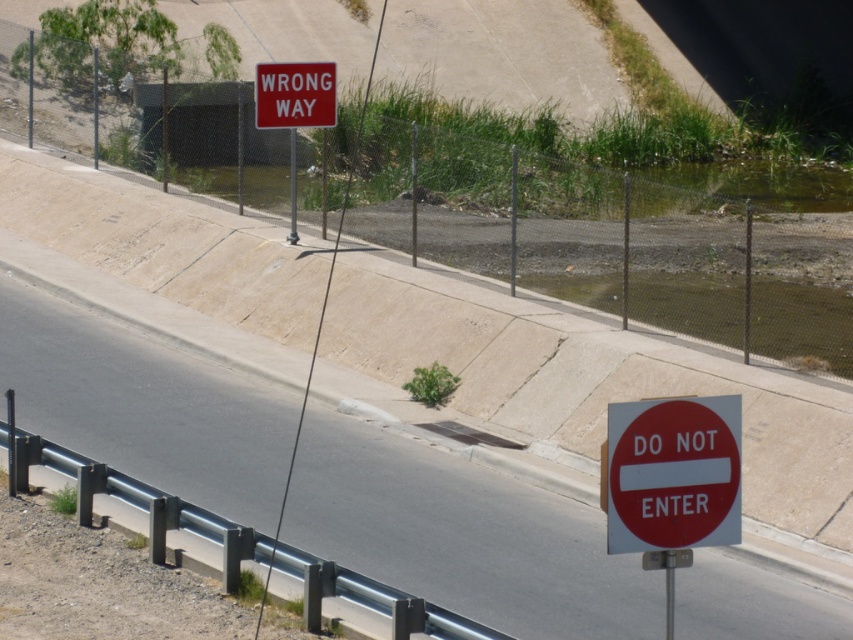
Question: Is red plastic sign at right further to the viewer compared to red matte sign at upper center?

Choices:
 (A) no
 (B) yes

Answer: (A)

Question: Does red plastic sign at right have a lesser width compared to red matte do not enter sign at lower right?

Choices:
 (A) yes
 (B) no

Answer: (B)

Question: Which point is closer to the camera?

Choices:
 (A) red matte sign at upper center
 (B) red matte do not enter sign at lower right
 (C) red plastic sign at right

Answer: (B)

Question: Which object is positioned farthest from the red matte sign at upper center?

Choices:
 (A) red matte do not enter sign at lower right
 (B) red plastic sign at right

Answer: (A)

Question: Can you confirm if red matte do not enter sign at lower right is wider than red matte sign at upper center?

Choices:
 (A) yes
 (B) no

Answer: (B)

Question: Which object is positioned farthest from the red matte do not enter sign at lower right?

Choices:
 (A) red matte sign at upper center
 (B) red plastic sign at right

Answer: (A)